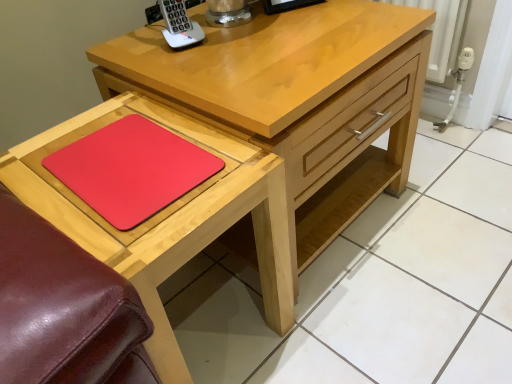
This screenshot has width=512, height=384. What do you see at coordinates (131, 170) in the screenshot?
I see `rubberized red mousepad at lower left` at bounding box center [131, 170].

The image size is (512, 384). Describe the element at coordinates (298, 97) in the screenshot. I see `matte wood chest of drawers at center` at that location.

Where is `matte wood chest of drawers at center`? matte wood chest of drawers at center is located at coordinates (298, 97).

This screenshot has height=384, width=512. What do you see at coordinates (179, 25) in the screenshot? I see `white plastic phone at upper center` at bounding box center [179, 25].

Describe the element at coordinates (170, 216) in the screenshot. I see `matte wooden table at lower left` at that location.

Locate an element on the screen. Image resolution: width=512 pixels, height=384 pixels. rubberized red mousepad at lower left is located at coordinates [x=131, y=170].

The width and height of the screenshot is (512, 384). Find the location of `the chest of drawers lying behind the rubberized red mousepad at lower left`. the chest of drawers lying behind the rubberized red mousepad at lower left is located at coordinates (298, 97).

Is matte wood chest of drawers at center facing towards rubberized red mousepad at lower left?

No, matte wood chest of drawers at center does not turn towards rubberized red mousepad at lower left.

Which object is positioned more to the left, matte wood chest of drawers at center or rubberized red mousepad at lower left?

Positioned to the left is rubberized red mousepad at lower left.

Considering the relative sizes of matte wooden table at lower left and white plastic phone at upper center in the image provided, is matte wooden table at lower left wider than white plastic phone at upper center?

Correct, the width of matte wooden table at lower left exceeds that of white plastic phone at upper center.

Does matte wooden table at lower left have a smaller size compared to white plastic phone at upper center?

Actually, matte wooden table at lower left might be larger than white plastic phone at upper center.

Does point (161, 108) appear closer or farther from the camera than point (195, 40)?

Point (161, 108).

Is matte wooden table at lower left looking in the opposite direction of white plastic phone at upper center?

No, matte wooden table at lower left is not facing the opposite direction of white plastic phone at upper center.

From the image's perspective, is matte wood chest of drawers at center over matte wooden table at lower left?

Yes, from the image's perspective, matte wood chest of drawers at center is over matte wooden table at lower left.

Considering the relative sizes of matte wood chest of drawers at center and matte wooden table at lower left in the image provided, is matte wood chest of drawers at center shorter than matte wooden table at lower left?

In fact, matte wood chest of drawers at center may be taller than matte wooden table at lower left.

Is matte wood chest of drawers at center to the right of matte wooden table at lower left from the viewer's perspective?

Correct, you'll find matte wood chest of drawers at center to the right of matte wooden table at lower left.

Considering the sizes of objects matte wood chest of drawers at center and matte wooden table at lower left in the image provided, who is smaller, matte wood chest of drawers at center or matte wooden table at lower left?

Smaller between the two is matte wooden table at lower left.

Which of these two, rubberized red mousepad at lower left or white plastic phone at upper center, stands taller?

Standing taller between the two is white plastic phone at upper center.

Is white plastic phone at upper center surrounded by rubberized red mousepad at lower left?

No, rubberized red mousepad at lower left does not contain white plastic phone at upper center.

In the scene shown: How many degrees apart are the facing directions of rubberized red mousepad at lower left and white plastic phone at upper center?

The facing directions of rubberized red mousepad at lower left and white plastic phone at upper center are 11.8 degrees apart.

Looking at this image, considering the sizes of objects rubberized red mousepad at lower left and white plastic phone at upper center in the image provided, who is thinner, rubberized red mousepad at lower left or white plastic phone at upper center?

white plastic phone at upper center.

Looking at this image, is matte wood chest of drawers at center aimed at white plastic phone at upper center?

No, matte wood chest of drawers at center is not oriented towards white plastic phone at upper center.

From the image's perspective, who appears lower, matte wood chest of drawers at center or white plastic phone at upper center?

matte wood chest of drawers at center is shown below in the image.

Does matte wood chest of drawers at center have a lesser width compared to white plastic phone at upper center?

No, matte wood chest of drawers at center is not thinner than white plastic phone at upper center.

Between matte wooden table at lower left and rubberized red mousepad at lower left, which one is positioned in front?

matte wooden table at lower left.

Looking at this image, from a real-world perspective, is matte wooden table at lower left over rubberized red mousepad at lower left?

Actually, matte wooden table at lower left is physically below rubberized red mousepad at lower left in the real world.

Which object is positioned more to the left, matte wooden table at lower left or rubberized red mousepad at lower left?

Positioned to the left is rubberized red mousepad at lower left.

From the image's perspective, is matte wooden table at lower left below matte wood chest of drawers at center?

Yes, from the image's perspective, matte wooden table at lower left is beneath matte wood chest of drawers at center.

Which is further, (x=137, y=256) or (x=346, y=78)?

The point (x=346, y=78) is behind.

From a real-world perspective, is matte wooden table at lower left on top of matte wood chest of drawers at center?

No, from a real-world perspective, matte wooden table at lower left is not above matte wood chest of drawers at center.

Locate an element on the screen. The height and width of the screenshot is (384, 512). pad that appears below the matte wood chest of drawers at center (from the image's perspective) is located at coordinates (131, 170).

This screenshot has height=384, width=512. In order to click on appliance located on the right of matte wooden table at lower left in this screenshot , I will do `click(179, 25)`.

Estimate the real-world distances between objects in this image. Which object is further from matte wooden table at lower left, matte wood chest of drawers at center or white plastic phone at upper center?

white plastic phone at upper center.

Considering their positions, is rubberized red mousepad at lower left positioned closer to matte wooden table at lower left than white plastic phone at upper center?

rubberized red mousepad at lower left is positioned closer to the anchor matte wooden table at lower left.

From the image, which object appears to be nearer to matte wood chest of drawers at center, white plastic phone at upper center or rubberized red mousepad at lower left?

white plastic phone at upper center lies closer to matte wood chest of drawers at center than the other object.

Which object lies nearer to the anchor point matte wood chest of drawers at center, rubberized red mousepad at lower left or white plastic phone at upper center?

white plastic phone at upper center is closer to matte wood chest of drawers at center.

Looking at the image, which one is located closer to rubberized red mousepad at lower left, white plastic phone at upper center or matte wooden table at lower left?

Among the two, matte wooden table at lower left is located nearer to rubberized red mousepad at lower left.

Looking at this image, when comparing their distances from matte wood chest of drawers at center, does rubberized red mousepad at lower left or matte wooden table at lower left seem further?

rubberized red mousepad at lower left lies further to matte wood chest of drawers at center than the other object.

Estimate the real-world distances between objects in this image. Which object is closer to matte wooden table at lower left, white plastic phone at upper center or rubberized red mousepad at lower left?

Among the two, rubberized red mousepad at lower left is located nearer to matte wooden table at lower left.

Estimate the real-world distances between objects in this image. Which object is closer to matte wooden table at lower left, matte wood chest of drawers at center or rubberized red mousepad at lower left?

Based on the image, rubberized red mousepad at lower left appears to be nearer to matte wooden table at lower left.

Identify the location of pad between matte wood chest of drawers at center and matte wooden table at lower left in the up-down direction. The image size is (512, 384). (131, 170).

Identify the location of pad between white plastic phone at upper center and matte wooden table at lower left from top to bottom. (131, 170).

Where is `chest of drawers between white plastic phone at upper center and matte wooden table at lower left in the up-down direction`? This screenshot has width=512, height=384. chest of drawers between white plastic phone at upper center and matte wooden table at lower left in the up-down direction is located at coordinates (298, 97).

This screenshot has height=384, width=512. I want to click on chest of drawers between white plastic phone at upper center and rubberized red mousepad at lower left in the vertical direction, so click(298, 97).